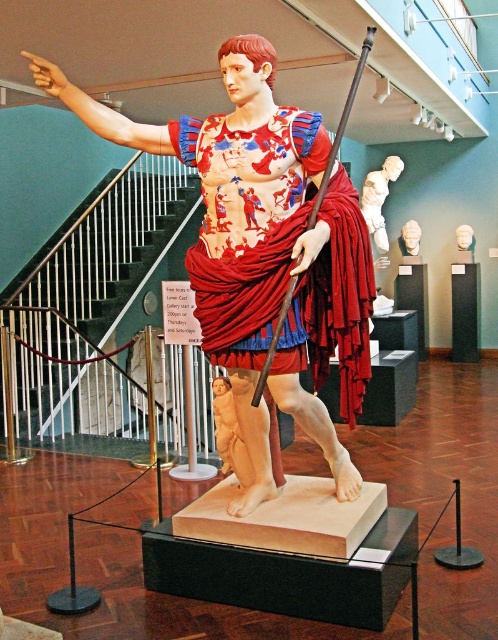
Is matte red fabric at center thinner than white marble statue at center?

Incorrect, matte red fabric at center's width is not less than white marble statue at center's.

Who is more forward, [254,44] or [373,204]?

Point [254,44] is in front.

Locate an element on the screen. This screenshot has height=640, width=498. matte red fabric at center is located at coordinates (264, 252).

Between white marble statue at center and matte white bust at center, which one is positioned higher?

white marble statue at center is higher up.

Measure the distance between point (371, 216) and camera.

Point (371, 216) is 7.87 meters from camera.

Which is in front, point (395, 179) or point (414, 253)?

Point (395, 179) is more forward.

Where is `white marble statue at center`? This screenshot has width=498, height=640. white marble statue at center is located at coordinates (378, 198).

Between point (237, 356) and point (459, 234), which one is positioned behind?

Point (459, 234)

Between red draped cloth at center and white marble mask at upper center, which one has less height?

white marble mask at upper center

Which is in front, point (335, 248) or point (459, 241)?

Point (335, 248) is more forward.

Locate an element on the screen. The width and height of the screenshot is (498, 640). red draped cloth at center is located at coordinates (248, 228).